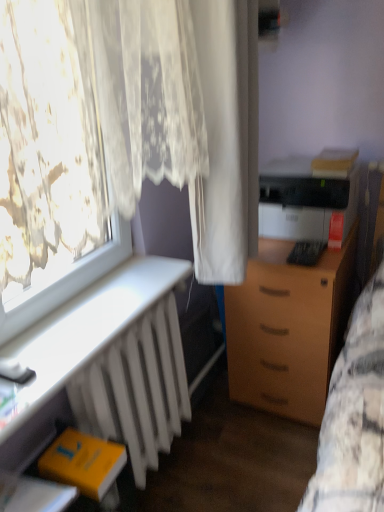
Question: Is wooden drawer at center-right turned away from yellow matte book at lower left?

Choices:
 (A) yes
 (B) no

Answer: (B)

Question: Can you confirm if wooden drawer at center-right is taller than yellow matte book at lower left?

Choices:
 (A) no
 (B) yes

Answer: (B)

Question: From a real-world perspective, does wooden drawer at center-right sit lower than yellow matte book at lower left?

Choices:
 (A) yes
 (B) no

Answer: (A)

Question: Is wooden drawer at center-right to the left of yellow matte book at lower left from the viewer's perspective?

Choices:
 (A) no
 (B) yes

Answer: (A)

Question: From the image's perspective, is wooden drawer at center-right over yellow matte book at lower left?

Choices:
 (A) no
 (B) yes

Answer: (B)

Question: Based on their sizes in the image, would you say white matte radiator at lower left is bigger or smaller than white sheer curtain at center?

Choices:
 (A) small
 (B) big

Answer: (A)

Question: Is white matte radiator at lower left to the left or to the right of white sheer curtain at center in the image?

Choices:
 (A) left
 (B) right

Answer: (A)

Question: Which is correct: white matte radiator at lower left is inside white sheer curtain at center, or outside of it?

Choices:
 (A) outside
 (B) inside

Answer: (A)

Question: Considering their positions, is white matte radiator at lower left located in front of or behind white sheer curtain at center?

Choices:
 (A) front
 (B) behind

Answer: (A)

Question: Is black plastic printer at right bigger or smaller than white sheer curtain at center?

Choices:
 (A) big
 (B) small

Answer: (B)

Question: Would you say black plastic printer at right is inside or outside white sheer curtain at center?

Choices:
 (A) outside
 (B) inside

Answer: (A)

Question: Is black plastic printer at right in front of or behind white sheer curtain at center in the image?

Choices:
 (A) behind
 (B) front

Answer: (A)

Question: From the image's perspective, is black plastic printer at right located above or below white sheer curtain at center?

Choices:
 (A) below
 (B) above

Answer: (A)

Question: Based on their sizes in the image, would you say white matte radiator at lower left is bigger or smaller than wooden drawer at center-right?

Choices:
 (A) small
 (B) big

Answer: (A)

Question: In the image, is white matte radiator at lower left positioned in front of or behind wooden drawer at center-right?

Choices:
 (A) behind
 (B) front

Answer: (B)